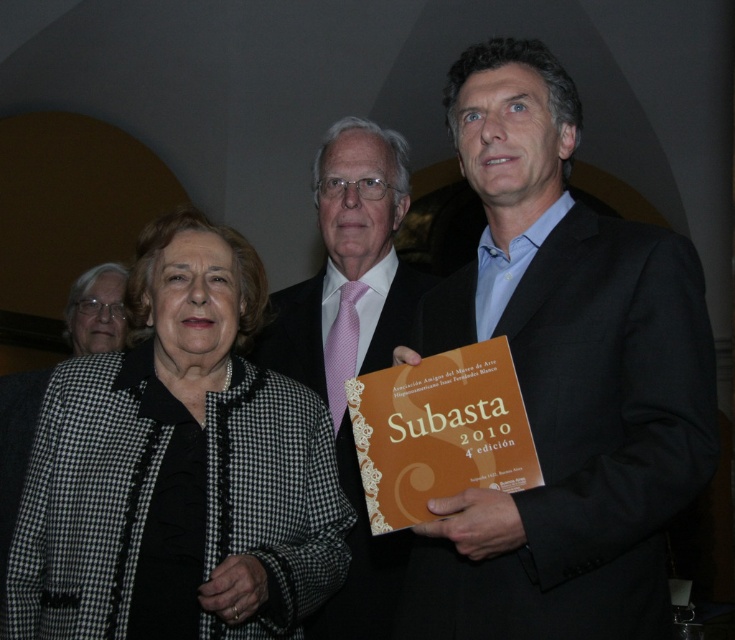
Question: Is black checkered jacket at center positioned before pink silk tie at center?

Choices:
 (A) yes
 (B) no

Answer: (A)

Question: Which object appears farthest from the camera in this image?

Choices:
 (A) pink silk tie at center
 (B) orange matte book at center
 (C) black suit at right
 (D) black checkered jacket at center

Answer: (A)

Question: Is black suit at right thinner than black checkered jacket at center?

Choices:
 (A) yes
 (B) no

Answer: (A)

Question: Does black suit at right appear over orange matte book at center?

Choices:
 (A) yes
 (B) no

Answer: (A)

Question: Which is farther from the pink silk tie at center?

Choices:
 (A) black checkered jacket at center
 (B) black suit at right

Answer: (B)

Question: Which is nearer to the black suit at right?

Choices:
 (A) orange matte book at center
 (B) pink silk tie at center
 (C) black checkered jacket at center

Answer: (A)